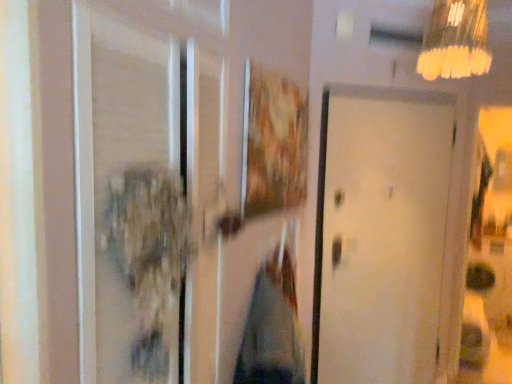
Question: Does transparent glass screen door at left have a larger size compared to yellow frosted glass lampshade at upper right?

Choices:
 (A) no
 (B) yes

Answer: (A)

Question: Is transparent glass screen door at left behind yellow frosted glass lampshade at upper right?

Choices:
 (A) no
 (B) yes

Answer: (A)

Question: Can you confirm if transparent glass screen door at left is wider than yellow frosted glass lampshade at upper right?

Choices:
 (A) yes
 (B) no

Answer: (B)

Question: Can we say transparent glass screen door at left lies outside yellow frosted glass lampshade at upper right?

Choices:
 (A) yes
 (B) no

Answer: (A)

Question: Is transparent glass screen door at left thinner than yellow frosted glass lampshade at upper right?

Choices:
 (A) no
 (B) yes

Answer: (B)

Question: From the image's perspective, relative to wooden textured picture frame at center, is white matte door at center above or below?

Choices:
 (A) below
 (B) above

Answer: (A)

Question: In terms of width, does white matte door at center look wider or thinner when compared to wooden textured picture frame at center?

Choices:
 (A) wide
 (B) thin

Answer: (A)

Question: Looking at the image, does white matte door at center seem bigger or smaller compared to wooden textured picture frame at center?

Choices:
 (A) big
 (B) small

Answer: (A)

Question: From a real-world perspective, relative to wooden textured picture frame at center, is white matte door at center vertically above or below?

Choices:
 (A) below
 (B) above

Answer: (A)

Question: From a real-world perspective, is wooden textured picture frame at center physically located above or below yellow frosted glass lampshade at upper right?

Choices:
 (A) below
 (B) above

Answer: (A)

Question: Does point (246, 198) appear closer or farther from the camera than point (451, 61)?

Choices:
 (A) closer
 (B) farther

Answer: (A)

Question: Is wooden textured picture frame at center in front of or behind yellow frosted glass lampshade at upper right in the image?

Choices:
 (A) behind
 (B) front

Answer: (B)

Question: From the image's perspective, is wooden textured picture frame at center located above or below yellow frosted glass lampshade at upper right?

Choices:
 (A) above
 (B) below

Answer: (B)

Question: Visually, is transparent glass screen door at left positioned to the left or to the right of white matte door at center?

Choices:
 (A) left
 (B) right

Answer: (A)

Question: Is point (180, 306) positioned closer to the camera than point (365, 269)?

Choices:
 (A) closer
 (B) farther

Answer: (A)